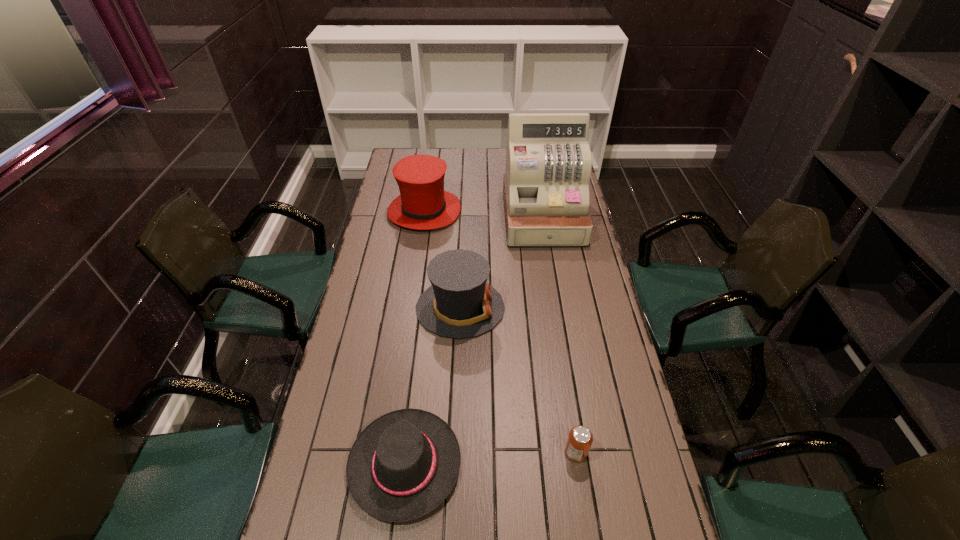
Image resolution: width=960 pixels, height=540 pixels. Find the location of `free spot between the can and the cash register`. free spot between the can and the cash register is located at coordinates (560, 335).

Find the location of `free space between the third shortest object and the can`. free space between the third shortest object and the can is located at coordinates (518, 380).

You are a GUI agent. You are given a task and a screenshot of the screen. Output one action in this format:
    pyautogui.click(x=<x>, y=<y>)
    Task: Click on the free space between the shortest dress hat and the can
    The width and height of the screenshot is (960, 540).
    Given the screenshot: What is the action you would take?
    pyautogui.click(x=491, y=458)

Locate an element on the screen. empty space between the third nearest object and the nearest dress hat is located at coordinates (433, 386).

Find the location of `free space between the tallest object and the third farthest object`. free space between the tallest object and the third farthest object is located at coordinates (501, 263).

Identify the location of empty space between the can and the second farthest dress hat. The height and width of the screenshot is (540, 960). (518, 380).

I want to click on free space between the cash register and the nearest dress hat, so click(x=474, y=341).

Identify which object is located as the nearest to the nearest dress hat. Please provide its 2D coordinates. Your answer should be formatted as a tuple, i.e. [(x, y)], where the tuple contains the x and y coordinates of a point satisfying the conditions above.

[(459, 304)]

The image size is (960, 540). What are the coordinates of `the fourth closest object to the nearest dress hat` in the screenshot? It's located at (423, 204).

Find the location of a particular element. dress hat that is the closest to the tallest object is located at coordinates (459, 304).